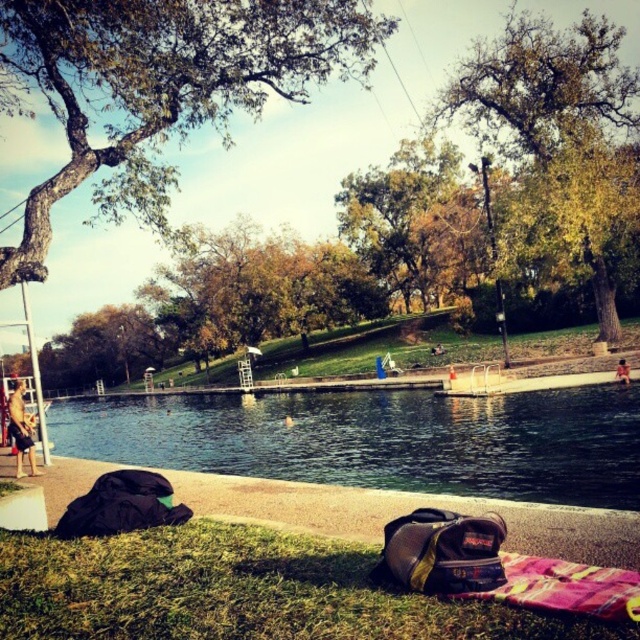
Question: Does clear blue water at center have a smaller size compared to black fabric sleeping bag at lower left?

Choices:
 (A) no
 (B) yes

Answer: (A)

Question: Which is nearer to the green leafy tree at center?

Choices:
 (A) green leafy tree at upper center
 (B) yellow-green fabric sleeping bag at lower center
 (C) tan skin person at lower left
 (D) black fabric sleeping bag at lower left

Answer: (A)

Question: Which object is positioned closest to the yellow-green fabric sleeping bag at lower center?

Choices:
 (A) green leafy tree at center
 (B) green grass at lower left
 (C) tan skin person at lower left

Answer: (B)

Question: Based on their relative distances, which object is farther from the tan skin person at lower left?

Choices:
 (A) skinny person at lower right
 (B) pink fabric blanket at lower right
 (C) green grass at lower left
 (D) green leafy tree at upper left

Answer: (D)

Question: Does clear blue water at center appear over green grass at lower left?

Choices:
 (A) yes
 (B) no

Answer: (B)

Question: Does green leafy tree at upper left appear under clear blue water at center?

Choices:
 (A) yes
 (B) no

Answer: (B)